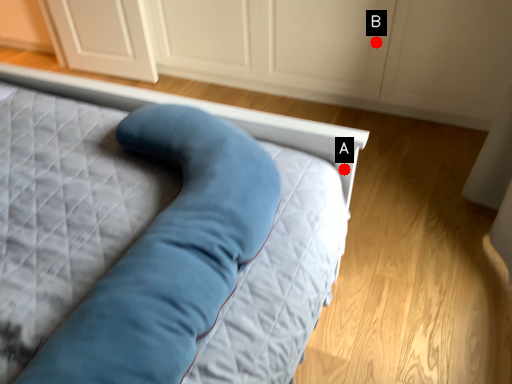
Question: Two points are circled on the image, labeled by A and B beside each circle. Which of the following is the farthest from the observer?

Choices:
 (A) A is further
 (B) B is further

Answer: (B)